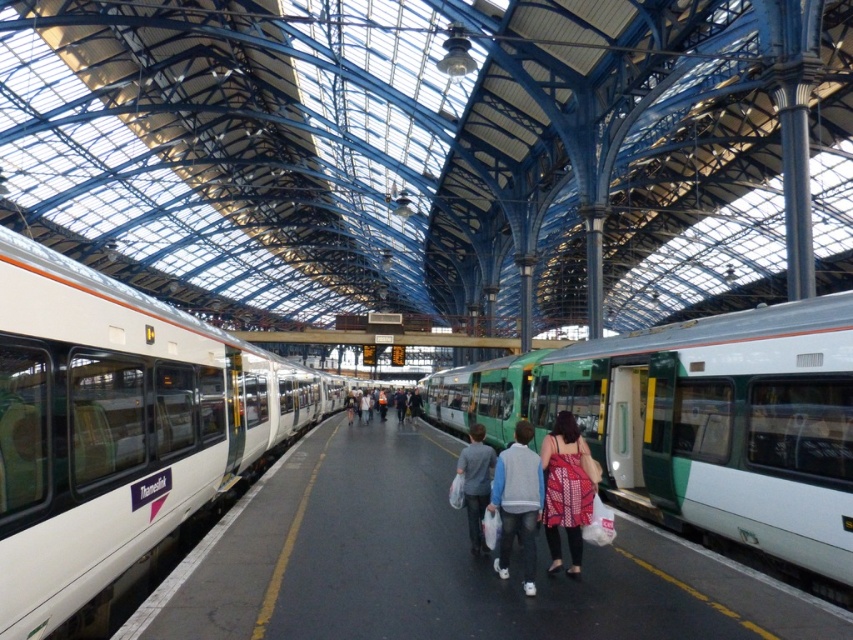
Question: Considering the real-world distances, which object is closest to the gray cotton shirt at center?

Choices:
 (A) dotted fabric dress at center
 (B) white glossy train at left

Answer: (A)

Question: Observing the image, what is the correct spatial positioning of light gray fleece jacket at center in reference to gray cotton shirt at center?

Choices:
 (A) below
 (B) above

Answer: (B)

Question: Which of the following is the farthest from the observer?

Choices:
 (A) green matte train at center
 (B) matte gray jacket at center
 (C) gray cotton shirt at center

Answer: (B)

Question: Does white glossy train at left appear on the right side of gray cotton shirt at center?

Choices:
 (A) no
 (B) yes

Answer: (A)

Question: Which of the following is the farthest from the observer?

Choices:
 (A) green matte train at center
 (B) dotted fabric dress at center
 (C) white glossy train at left

Answer: (B)

Question: Does white glossy train at left have a smaller size compared to green matte train at center?

Choices:
 (A) no
 (B) yes

Answer: (B)